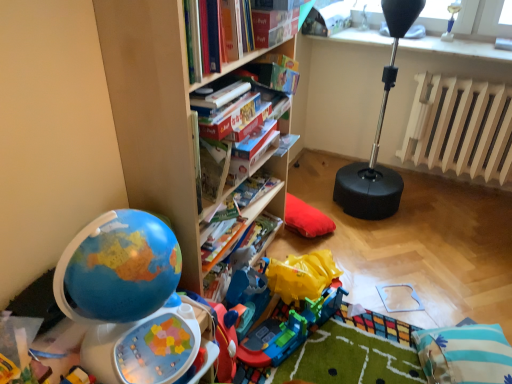
Locate an element on the screen. shiny plastic globe at left is located at coordinates (128, 299).

What do you see at coordinates (457, 48) in the screenshot?
I see `black rubber punching bag at upper right` at bounding box center [457, 48].

Measure the distance between hardcover book at center and camera.

hardcover book at center is 1.56 meters from camera.

This screenshot has width=512, height=384. What do you see at coordinates (243, 222) in the screenshot? I see `hardcover book at center` at bounding box center [243, 222].

You are a GUI agent. You are given a task and a screenshot of the screen. Output one action in this format:
    pyautogui.click(x=<x>, y=<y>)
    Task: Click on the wooden bookshelf at center
    Image resolution: width=512 pixels, height=384 pixels.
    Given the screenshot: What is the action you would take?
    pyautogui.click(x=155, y=113)

Between blue striped pillow at lower right and hardcover book at center, marked as the first paperback book in a back-to-front arrangement, which one is positioned behind?

hardcover book at center, marked as the first paperback book in a back-to-front arrangement, is more distant.

In the scene shown: Measure the distance from blue striped pillow at lower right to hardcover book at center, marked as the first paperback book in a back-to-front arrangement.

blue striped pillow at lower right and hardcover book at center, marked as the first paperback book in a back-to-front arrangement, are 3.54 feet apart from each other.

Is hardcover book at center, marked as the first paperback book in a back-to-front arrangement, inside blue striped pillow at lower right?

Actually, hardcover book at center, marked as the first paperback book in a back-to-front arrangement, is outside blue striped pillow at lower right.

Between blue striped pillow at lower right and hardcover book at center, the 2th paperback book when ordered from front to back, which one has less height?

Standing shorter between the two is hardcover book at center, the 2th paperback book when ordered from front to back.

Is wooden radiator at right touching black rubber punching bag at upper right?

wooden radiator at right is not next to black rubber punching bag at upper right, and they're not touching.

Is black rubber punching bag at upper right at the back of wooden radiator at right?

wooden radiator at right is not turned away from black rubber punching bag at upper right.

Does point (450, 83) appear closer or farther from the camera than point (368, 33)?

Point (450, 83) is positioned closer to the camera compared to point (368, 33).

Would you say wooden radiator at right contains black rubber punching bag at upper right?

No, black rubber punching bag at upper right is not surrounded by wooden radiator at right.

Does hardcover book at center appear on the left side of blue striped pillow at lower right?

Correct, you'll find hardcover book at center to the left of blue striped pillow at lower right.

Looking at this image, is hardcover book at center bigger or smaller than blue striped pillow at lower right?

Clearly, hardcover book at center is smaller in size than blue striped pillow at lower right.

Can you tell me how much hardcover book at center and blue striped pillow at lower right differ in facing direction?

The angle between the facing direction of hardcover book at center and the facing direction of blue striped pillow at lower right is 157 degrees.

Is hardcover book at center far away from blue striped pillow at lower right?

No.

From the image's perspective, is hardcover book at center, marked as the first paperback book in a back-to-front arrangement, positioned above or below blue striped pillow at lower right?

hardcover book at center, marked as the first paperback book in a back-to-front arrangement, is situated higher than blue striped pillow at lower right in the image.

From the picture: From a real-world perspective, is hardcover book at center, marked as the first paperback book in a back-to-front arrangement, physically below blue striped pillow at lower right?

No, from a real-world perspective, hardcover book at center, marked as the first paperback book in a back-to-front arrangement, is not beneath blue striped pillow at lower right.

Considering the sizes of objects hardcover book at center, the 2th paperback book when ordered from front to back, and blue striped pillow at lower right in the image provided, who is shorter, hardcover book at center, the 2th paperback book when ordered from front to back, or blue striped pillow at lower right?

hardcover book at center, the 2th paperback book when ordered from front to back.

Is blue striped pillow at lower right located within hardcover book at center, marked as the first paperback book in a back-to-front arrangement?

No, blue striped pillow at lower right is not inside hardcover book at center, marked as the first paperback book in a back-to-front arrangement.

Can you confirm if shiny plastic globe at left is positioned to the right of wooden bookshelf at center?

No.

Is shiny plastic globe at left positioned with its back to wooden bookshelf at center?

shiny plastic globe at left is not turned away from wooden bookshelf at center.

The image size is (512, 384). I want to click on bookcase located behind the shiny plastic globe at left, so click(155, 113).

Considering their positions, is shiny plastic globe at left located in front of or behind wooden bookshelf at center?

shiny plastic globe at left is positioned closer to the viewer than wooden bookshelf at center.

From the image's perspective, is blue striped pillow at lower right located above or below hardcover book at center?

blue striped pillow at lower right is below hardcover book at center.

From a real-world perspective, is blue striped pillow at lower right on hardcover book at center?

No.

Can you confirm if blue striped pillow at lower right is taller than hardcover book at center?

Yes, blue striped pillow at lower right is taller than hardcover book at center.

Can you tell me how much blue striped pillow at lower right and hardcover book at center differ in facing direction?

157 degrees separate the facing orientations of blue striped pillow at lower right and hardcover book at center.

Is wooden bookshelf at center inside or outside of hardcover book at center?

wooden bookshelf at center is not enclosed by hardcover book at center.

Who is smaller, wooden bookshelf at center or hardcover book at center?

hardcover book at center.

Consider the image. Considering the relative sizes of wooden bookshelf at center and hardcover book at center in the image provided, is wooden bookshelf at center taller than hardcover book at center?

Yes.

I want to click on the 1st paperback book directly above the blue striped pillow at lower right (from a real-world perspective), so click(x=254, y=141).

Find the location of a particular element. radiator located in front of the black rubber punching bag at upper right is located at coordinates (460, 127).

From the image, which object appears to be farther from wooden bookshelf at center, blue striped pillow at lower right or hardcover book at center, marked as the first paperback book in a back-to-front arrangement?

The object further to wooden bookshelf at center is blue striped pillow at lower right.

Based on their spatial positions, is black rubber punching bag at upper right or shiny plastic globe at left closer to hardcover book at center?

shiny plastic globe at left.

When comparing their distances from blue striped pillow at lower right, does hardcover book at center or black rubber punching bag at upper right seem further?

black rubber punching bag at upper right lies further to blue striped pillow at lower right than the other object.

Looking at the image, which one is located further to black rubber punching bag at upper right, hardcover book at center, which ranks as the 1th paperback book in front-to-back order, or wooden bookshelf at center?

wooden bookshelf at center is positioned further to the anchor black rubber punching bag at upper right.

Estimate the real-world distances between objects in this image. Which object is closer to hardcover book at center, hardcover book at center, which ranks as the 1th paperback book in front-to-back order, or wooden radiator at right?

hardcover book at center, which ranks as the 1th paperback book in front-to-back order, is closer to hardcover book at center.

Based on their spatial positions, is wooden radiator at right or hardcover book at center, marked as the first paperback book in a back-to-front arrangement, further from wooden bookshelf at center?

Among the two, wooden radiator at right is located further to wooden bookshelf at center.

Looking at the image, which one is located further to hardcover book at center, hardcover book at center, marked as the first paperback book in a back-to-front arrangement, or wooden bookshelf at center?

wooden bookshelf at center is positioned further to the anchor hardcover book at center.

Considering their positions, is hardcover book at center positioned further to black rubber punching bag at upper right than wooden bookshelf at center?

The object further to black rubber punching bag at upper right is wooden bookshelf at center.

This screenshot has height=384, width=512. I want to click on paperback book located between hardcover book at center and wooden radiator at right in the left-right direction, so (254, 141).

Find the location of a particular element. This screenshot has width=512, height=384. paperback book between hardcover book at center, the second paperback book in the back-to-front sequence, and wooden radiator at right is located at coordinates (254, 141).

Where is `book between shiny plastic globe at left and wooden radiator at right in the horizontal direction`? This screenshot has width=512, height=384. book between shiny plastic globe at left and wooden radiator at right in the horizontal direction is located at coordinates point(243,222).

Locate an element on the screen. This screenshot has height=384, width=512. paperback book situated between hardcover book at center and blue striped pillow at lower right from left to right is located at coordinates (254, 141).